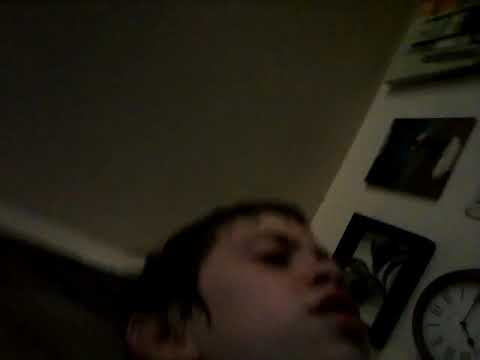
Where is `clock`? clock is located at coordinates (449, 328).